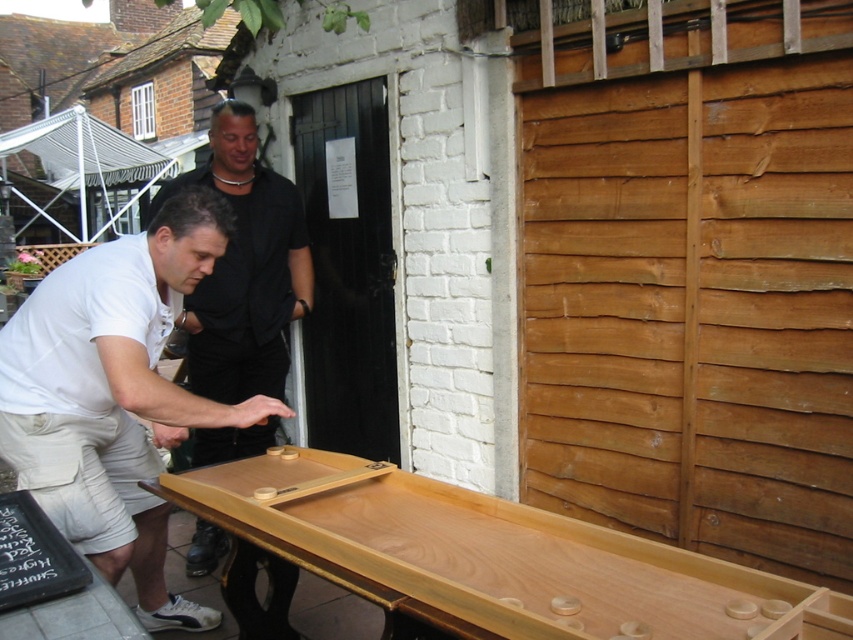
You are a photographer setting up a shot of the shuffleboard game. You want to capture both the natural wood shuffleboard at center and the white cotton shirt at center in the frame. Since you need to ensure the entire shuffleboard and shirt are visible, which object requires a wider angle to capture in full?

The natural wood shuffleboard at center requires a wider angle because its width is larger than the white cotton shirt at center.

You are standing at the point marked as point (114, 396) in the image. What object is directly in front of you?

The point (114, 396) corresponds to the white cotton shirt at center.

Based on the photo, you are a photographer trying to capture a wide shot of the natural wood shuffleboard at center and the matte black shirt at center. Given that your camera can only focus on objects within a 3 meter width, will both objects fit in the frame?

The natural wood shuffleboard at center is wider than the matte black shirt at center. Since the camera can focus on objects within a 3 meter width, both objects will fit in the frame as long as their combined width does not exceed 3 meters. However, the exact dimensions are not provided, so we cannot confirm for certain.